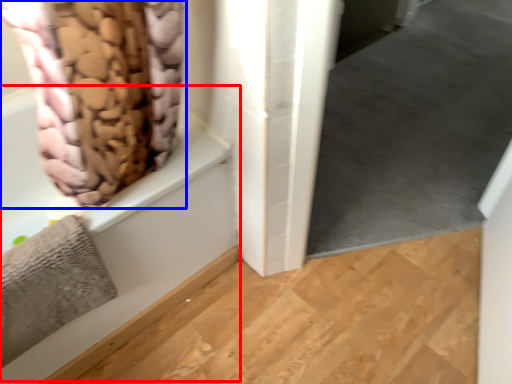
Question: Among these objects, which one is farthest to the camera, bath (highlighted by a red box) or curtain (highlighted by a blue box)?

Choices:
 (A) bath
 (B) curtain

Answer: (A)